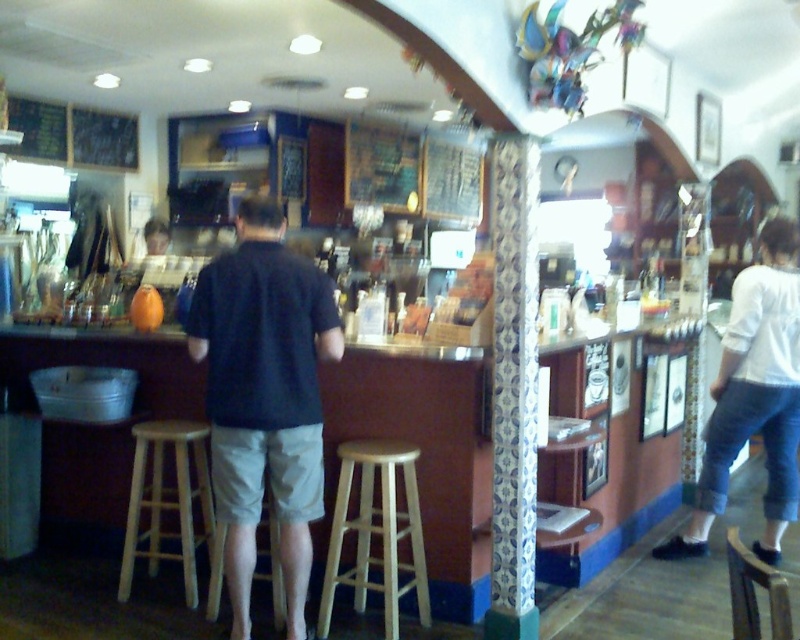
Can you confirm if white cotton shirt at right is positioned to the left of blue and white patterned column at center?

Incorrect, white cotton shirt at right is not on the left side of blue and white patterned column at center.

Between point (709, 440) and point (530, 612), which one is positioned in front?

Point (530, 612)

Locate an element on the screen. The height and width of the screenshot is (640, 800). white cotton shirt at right is located at coordinates (754, 396).

Where is `white cotton shirt at right`? This screenshot has width=800, height=640. white cotton shirt at right is located at coordinates click(x=754, y=396).

Measure the distance between white cotton shirt at right and camera.

white cotton shirt at right and camera are 3.55 meters apart.

Is point (770, 241) positioned before point (188, 512)?

No.

Locate an element on the screen. Image resolution: width=800 pixels, height=640 pixels. white cotton shirt at right is located at coordinates (754, 396).

Between light wood bar stool at center and light brown wooden stool at center, which one appears on the right side from the viewer's perspective?

From the viewer's perspective, light wood bar stool at center appears more on the right side.

Does light wood bar stool at center have a greater height compared to light brown wooden stool at center?

In fact, light wood bar stool at center may be shorter than light brown wooden stool at center.

Is point (416, 451) less distant than point (204, 532)?

Yes.

Locate an element on the screen. The height and width of the screenshot is (640, 800). light wood bar stool at center is located at coordinates (376, 531).